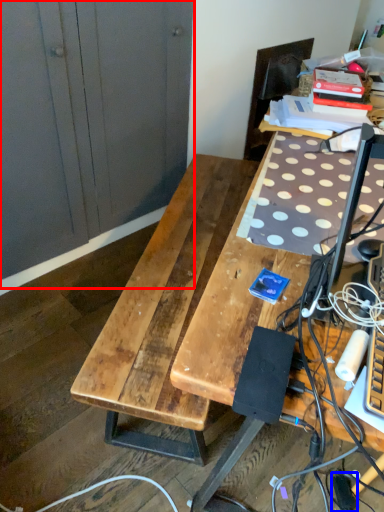
Question: Which point is further to the camera, dresser (highlighted by a red box) or extension cord (highlighted by a blue box)?

Choices:
 (A) dresser
 (B) extension cord

Answer: (B)